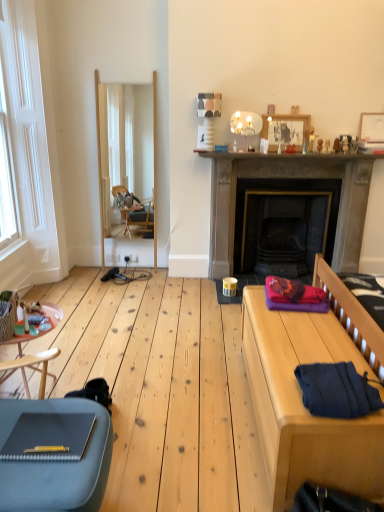
Question: In the image, is dark blue knitted sweater at lower right on the left side or the right side of white wood window at left?

Choices:
 (A) right
 (B) left

Answer: (A)

Question: Is dark blue knitted sweater at lower right in front of or behind white wood window at left in the image?

Choices:
 (A) behind
 (B) front

Answer: (B)

Question: Based on their relative distances, which object is farther from the dark blue knitted sweater at lower right?

Choices:
 (A) wooden side table at lower left
 (B) wooden picture frame at upper center, acting as the 2th picture frame starting from the right
 (C) white wood window at left
 (D) dark gray stone fireplace at center
 (E) wooden picture frame at upper right, the first picture frame from the right

Answer: (C)

Question: Considering the real-world distances, which object is farthest from the wooden side table at lower left?

Choices:
 (A) dark blue knitted sweater at lower right
 (B) white wood window at left
 (C) wooden picture frame at upper right, the first picture frame from the right
 (D) stone fireplace mantel at center
 (E) wooden picture frame at upper center, acting as the 2th picture frame starting from the right

Answer: (C)